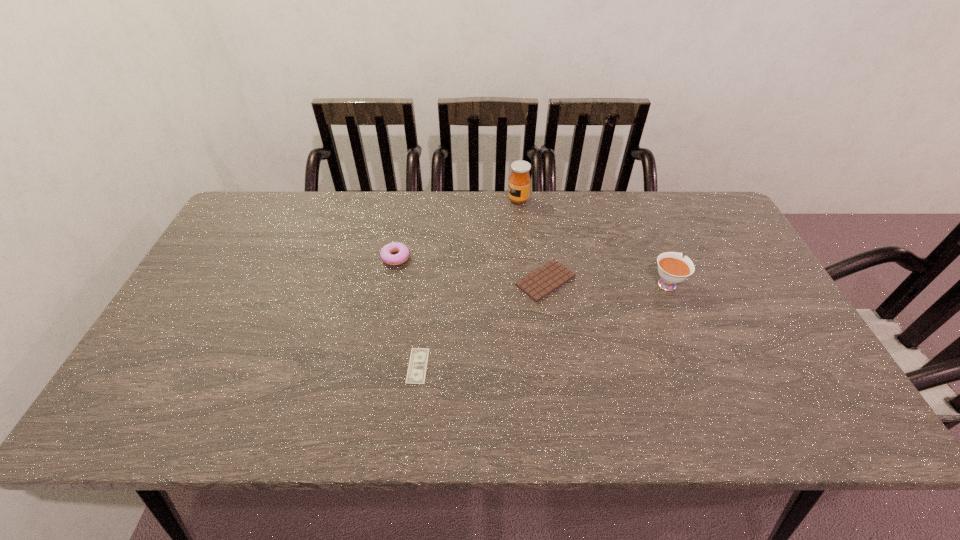
You are a GUI agent. You are given a task and a screenshot of the screen. Output one action in this format:
    pyautogui.click(x=<x>, y=<y>)
    Task: Click on the farthest object
    
    Given the screenshot: What is the action you would take?
    pyautogui.click(x=519, y=181)

You are a GUI agent. You are given a task and a screenshot of the screen. Output one action in this format:
    pyautogui.click(x=<x>, y=<y>)
    Task: Click on the tallest object
    
    Given the screenshot: What is the action you would take?
    pyautogui.click(x=519, y=181)

I want to click on the second tallest object, so click(672, 269).

Find the location of `teacup`. teacup is located at coordinates tap(672, 269).

Locate an element on the screen. The height and width of the screenshot is (540, 960). the leftmost object is located at coordinates (386, 253).

Image resolution: width=960 pixels, height=540 pixels. What are the coordinates of `the third shortest object` in the screenshot? It's located at (386, 253).

Locate an element on the screen. This screenshot has height=540, width=960. the fourth tallest object is located at coordinates (543, 281).

Locate an element on the screen. The width and height of the screenshot is (960, 540). the nearest object is located at coordinates (417, 367).

The height and width of the screenshot is (540, 960). Find the location of `the shortest object`. the shortest object is located at coordinates (417, 367).

Where is `vacant space situated 0.180m on the front-facing side of the farthest object`? The height and width of the screenshot is (540, 960). vacant space situated 0.180m on the front-facing side of the farthest object is located at coordinates (455, 200).